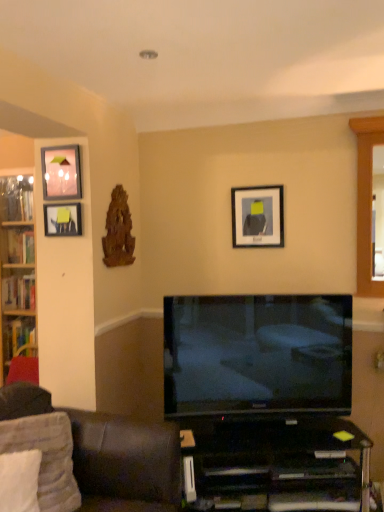
Question: From the image's perspective, is white soft pillow at lower left, which ranks as the 2th pillow in back-to-front order, on top of dark brown leather couch at lower left?

Choices:
 (A) yes
 (B) no

Answer: (A)

Question: Considering the relative positions of white soft pillow at lower left, which ranks as the 2th pillow in back-to-front order, and dark brown leather couch at lower left in the image provided, is white soft pillow at lower left, which ranks as the 2th pillow in back-to-front order, to the right of dark brown leather couch at lower left from the viewer's perspective?

Choices:
 (A) yes
 (B) no

Answer: (B)

Question: Considering the relative sizes of white soft pillow at lower left, which ranks as the 2th pillow in back-to-front order, and dark brown leather couch at lower left in the image provided, is white soft pillow at lower left, which ranks as the 2th pillow in back-to-front order, bigger than dark brown leather couch at lower left?

Choices:
 (A) yes
 (B) no

Answer: (B)

Question: Considering the relative sizes of white soft pillow at lower left, which ranks as the 2th pillow in back-to-front order, and dark brown leather couch at lower left in the image provided, is white soft pillow at lower left, which ranks as the 2th pillow in back-to-front order, smaller than dark brown leather couch at lower left?

Choices:
 (A) yes
 (B) no

Answer: (A)

Question: From a real-world perspective, is white soft pillow at lower left, placed as the 1th pillow when sorted from front to back, under dark brown leather couch at lower left?

Choices:
 (A) no
 (B) yes

Answer: (A)

Question: Is white soft pillow at lower left, placed as the 1th pillow when sorted from front to back, directly adjacent to dark brown leather couch at lower left?

Choices:
 (A) yes
 (B) no

Answer: (B)

Question: Can you see wooden bookshelf at left touching white soft pillow at lower left, placed as the 1th pillow when sorted from front to back?

Choices:
 (A) no
 (B) yes

Answer: (A)

Question: From the image's perspective, is wooden bookshelf at left located above white soft pillow at lower left, placed as the 1th pillow when sorted from front to back?

Choices:
 (A) yes
 (B) no

Answer: (A)

Question: Is the position of wooden bookshelf at left more distant than that of white soft pillow at lower left, which ranks as the 2th pillow in back-to-front order?

Choices:
 (A) no
 (B) yes

Answer: (B)

Question: From a real-world perspective, is wooden bookshelf at left physically below white soft pillow at lower left, which ranks as the 2th pillow in back-to-front order?

Choices:
 (A) yes
 (B) no

Answer: (B)

Question: Would you say wooden bookshelf at left is a long distance from white soft pillow at lower left, placed as the 1th pillow when sorted from front to back?

Choices:
 (A) no
 (B) yes

Answer: (B)

Question: Is wooden bookshelf at left not within white soft pillow at lower left, which ranks as the 2th pillow in back-to-front order?

Choices:
 (A) no
 (B) yes

Answer: (B)

Question: Can you confirm if white fabric pillow at lower left, placed as the 1th pillow when sorted from back to front, is shorter than wooden bookshelf at left?

Choices:
 (A) no
 (B) yes

Answer: (B)